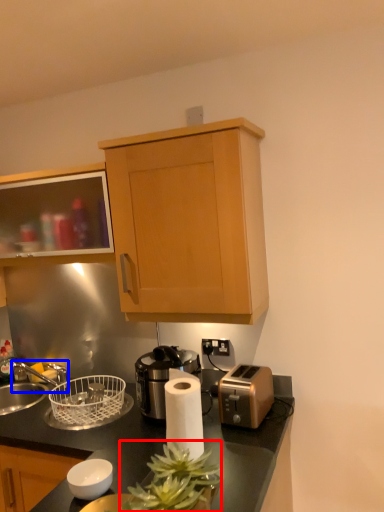
Question: Which point is further to the camera, plant (highlighted by a red box) or faucet (highlighted by a blue box)?

Choices:
 (A) plant
 (B) faucet

Answer: (B)